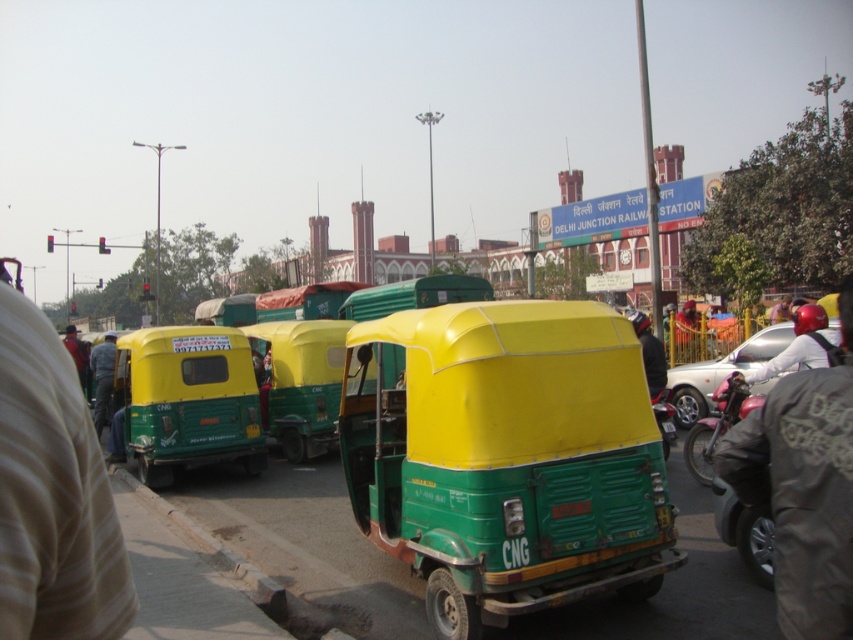
Question: Which is farther from the green matte auto-rickshaw at left?

Choices:
 (A) yellow-green plastic auto-rickshaw at center-right
 (B) metallic green motorcycle at center

Answer: (A)

Question: Which of the following is the closest to the observer?

Choices:
 (A) (666, 369)
 (B) (837, 557)
 (C) (96, 381)
 (D) (741, 397)

Answer: (B)

Question: Estimate the real-world distances between objects in this image. Which object is closer to the green matte auto-rickshaw at left?

Choices:
 (A) yellow-green plastic auto-rickshaw at center-right
 (B) shiny red motorcycle at right
 (C) metallic silver car at right

Answer: (B)

Question: Does yellow-green plastic auto-rickshaw at center-right appear on the right side of shiny red motorcycle at right?

Choices:
 (A) yes
 (B) no

Answer: (B)

Question: Does shiny red motorcycle at right appear over metallic green motorcycle at center?

Choices:
 (A) no
 (B) yes

Answer: (B)

Question: Can you confirm if yellow-green plastic auto-rickshaw at center-right is thinner than metallic green motorcycle at center?

Choices:
 (A) no
 (B) yes

Answer: (B)